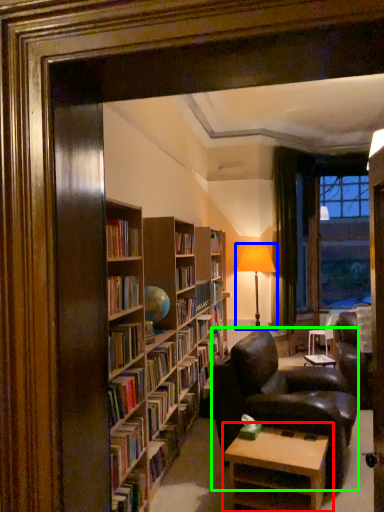
Question: Estimate the real-world distances between objects in this image. Which object is farther from table (highlighted by a red box), table lamp (highlighted by a blue box) or chair (highlighted by a green box)?

Choices:
 (A) table lamp
 (B) chair

Answer: (A)